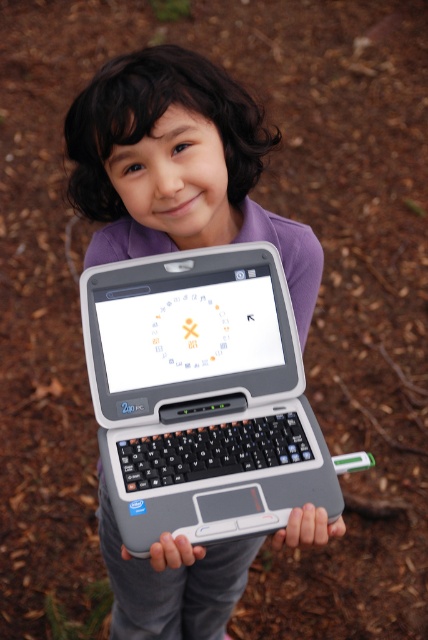
Can you confirm if matte gray laptop at center is positioned above gray matte laptop at center?

Indeed, matte gray laptop at center is positioned over gray matte laptop at center.

Between matte gray laptop at center and gray matte laptop at center, which one is positioned higher?

matte gray laptop at center is higher up.

Which is behind, point (291, 532) or point (181, 536)?

The point (181, 536) is more distant.

Where is `matte gray laptop at center`? matte gray laptop at center is located at coordinates (308, 528).

Does gray plastic laptop at center come behind gray matte laptop at center?

Yes, it is behind gray matte laptop at center.

Does point (143, 484) come behind point (160, 564)?

Yes.

Find the location of a particular element. The height and width of the screenshot is (640, 428). gray plastic laptop at center is located at coordinates (201, 394).

Does gray plastic laptop at center have a larger size compared to matte gray laptop at center?

Yes.

Is point (133, 378) less distant than point (273, 538)?

That is False.

Image resolution: width=428 pixels, height=640 pixels. Identify the location of gray plastic laptop at center. (201, 394).